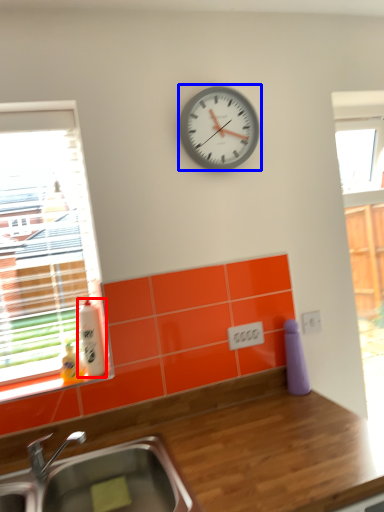
Question: Which object appears farthest to the camera in this image, bottle (highlighted by a red box) or wall clock (highlighted by a blue box)?

Choices:
 (A) bottle
 (B) wall clock

Answer: (B)